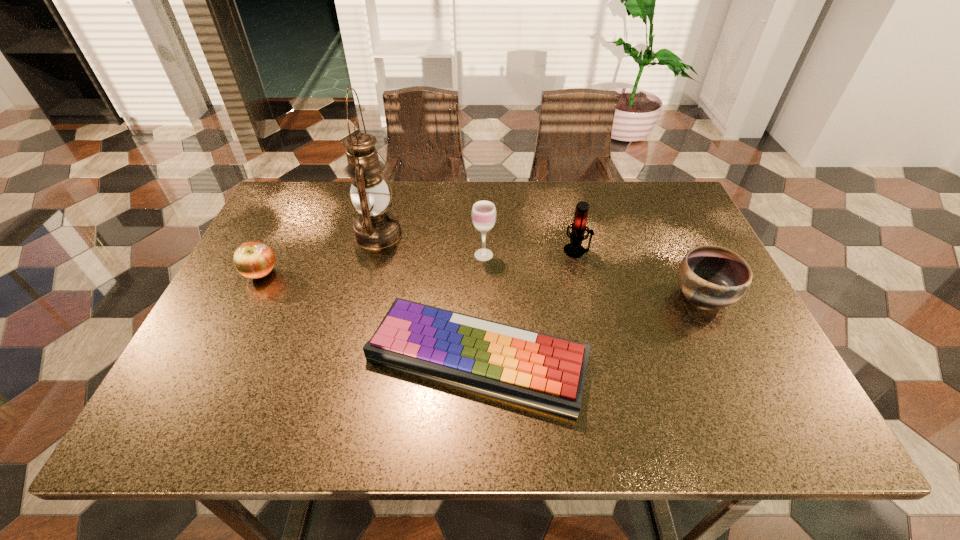
The image size is (960, 540). Identify the location of free space between the microphone and the computer keyboard. (527, 304).

Find the location of `vacant area between the rightmost object and the wineglass`. vacant area between the rightmost object and the wineglass is located at coordinates (593, 275).

Locate which object ranks fifth in proximity to the leftmost object. Please provide its 2D coordinates. Your answer should be formatted as a tuple, i.e. [(x, y)], where the tuple contains the x and y coordinates of a point satisfying the conditions above.

[(710, 276)]

Select which object appears as the second closest to the second shortest object. Please provide its 2D coordinates. Your answer should be formatted as a tuple, i.e. [(x, y)], where the tuple contains the x and y coordinates of a point satisfying the conditions above.

[(542, 371)]

Locate an element on the screen. Image resolution: width=960 pixels, height=540 pixels. vacant space that satisfies the following two spatial constraints: 1. on the front side of the second shortest object; 2. on the right side of the computer keyboard is located at coordinates (219, 357).